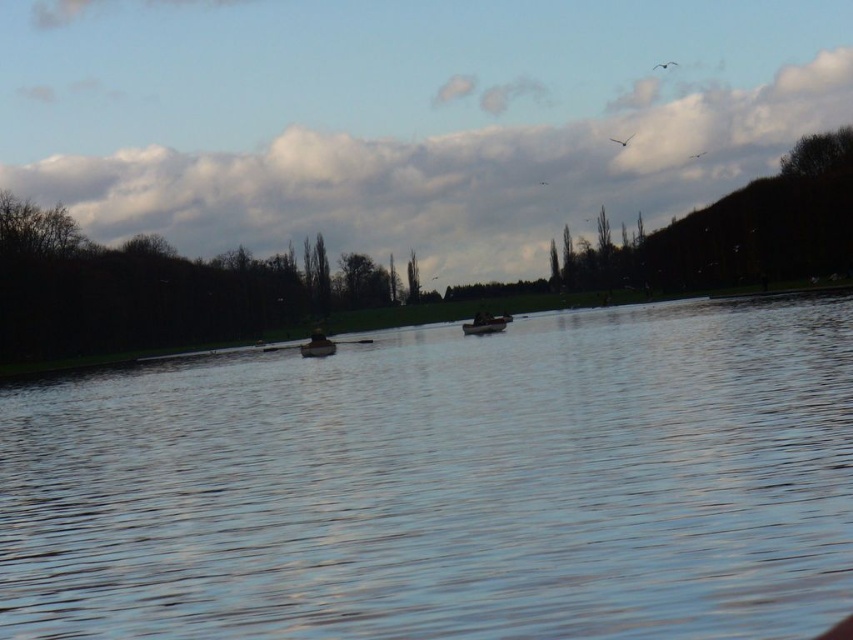
Question: Does smooth water at center have a smaller size compared to dark brown wooden boat at center?

Choices:
 (A) yes
 (B) no

Answer: (B)

Question: Which is nearer to the smooth water at center?

Choices:
 (A) wooden boat at center
 (B) dark brown wooden boat at center

Answer: (B)

Question: Does smooth water at center have a greater width compared to wooden boat at center?

Choices:
 (A) yes
 (B) no

Answer: (A)

Question: Among these points, which one is nearest to the camera?

Choices:
 (A) (300, 352)
 (B) (488, 330)

Answer: (B)

Question: Is smooth water at center to the left of dark brown wooden boat at center from the viewer's perspective?

Choices:
 (A) no
 (B) yes

Answer: (A)

Question: Among these points, which one is farthest from the camera?

Choices:
 (A) (329, 353)
 (B) (462, 364)

Answer: (A)